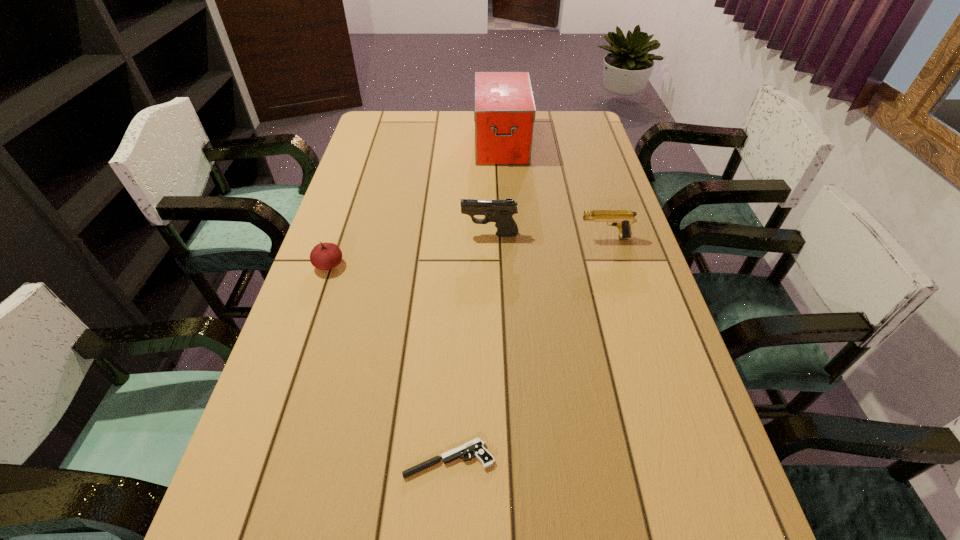
Select which pistol appears as the second closest to the second tallest object. Please provide its 2D coordinates. Your answer should be formatted as a tuple, i.e. [(x, y)], where the tuple contains the x and y coordinates of a point satisfying the conditions above.

[(476, 446)]

The height and width of the screenshot is (540, 960). What are the coordinates of `vacant region that satisfies the following two spatial constraints: 1. at the barrel of the rightmost pistol; 2. on the front side of the second nearest object` in the screenshot? It's located at [613, 265].

Find the location of a particular element. Image resolution: width=960 pixels, height=540 pixels. blank area in the image that satisfies the following two spatial constraints: 1. on the handle side of the first-aid kit; 2. at the barrel of the second tallest object is located at coordinates (507, 235).

This screenshot has width=960, height=540. I want to click on vacant space that satisfies the following two spatial constraints: 1. on the handle side of the first-aid kit; 2. on the front-facing side of the shortest pistol, so click(x=522, y=459).

This screenshot has width=960, height=540. Identify the location of vacant position in the image that satisfies the following two spatial constraints: 1. on the handle side of the first-aid kit; 2. at the barrel of the fourth shortest object. (507, 235).